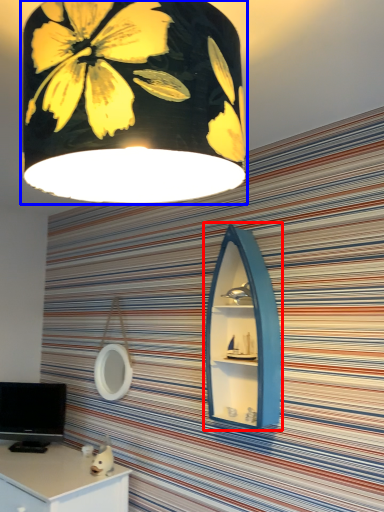
Question: Which of the following is the farthest to the observer, medicine cabinet (highlighted by a red box) or lamp (highlighted by a blue box)?

Choices:
 (A) medicine cabinet
 (B) lamp

Answer: (A)